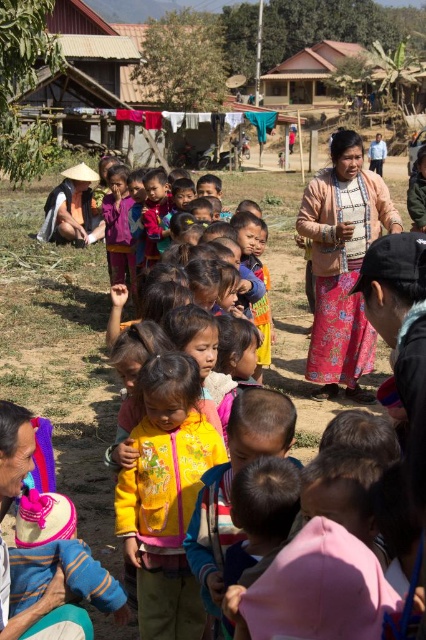
Question: Can you confirm if wooden hut at upper center is smaller than yellow fleece jacket at center?

Choices:
 (A) yes
 (B) no

Answer: (B)

Question: Which point is closer to the camera?

Choices:
 (A) (178, 561)
 (B) (146, 100)

Answer: (A)

Question: Which point is farther to the camera?

Choices:
 (A) yellow fleece jacket at center
 (B) wooden hut at upper center

Answer: (B)

Question: Is the position of wooden hut at upper center more distant than that of yellow fleece jacket at center?

Choices:
 (A) yes
 (B) no

Answer: (A)

Question: Which point is farther to the camera?

Choices:
 (A) yellow fleece jacket at center
 (B) wooden hut at upper center

Answer: (B)

Question: Observing the image, what is the correct spatial positioning of wooden hut at upper center in reference to yellow fleece jacket at center?

Choices:
 (A) right
 (B) left

Answer: (B)